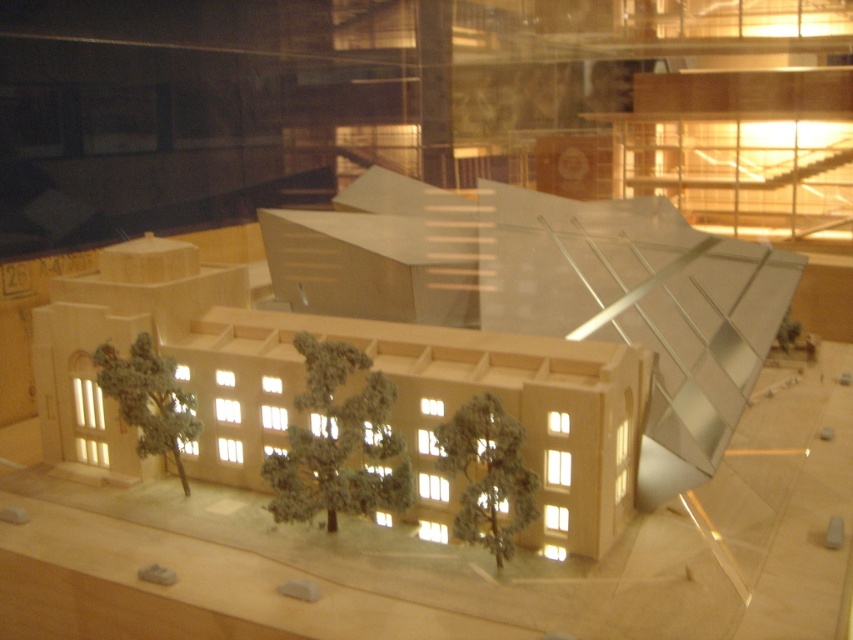
Question: Which object is farther from the camera taking this photo?

Choices:
 (A) green matte tree at lower left
 (B) green matte tree at center

Answer: (A)

Question: Does green matte tree at center have a lesser width compared to green matte tree at lower left?

Choices:
 (A) yes
 (B) no

Answer: (A)

Question: Estimate the real-world distances between objects in this image. Which object is closer to the green matte tree at lower left?

Choices:
 (A) green textured tree at center
 (B) green matte tree at center

Answer: (A)

Question: From the image, what is the correct spatial relationship of green textured tree at center in relation to green matte tree at lower left?

Choices:
 (A) right
 (B) left

Answer: (A)

Question: Which point appears closest to the camera in this image?

Choices:
 (A) (299, 349)
 (B) (167, 452)
 (C) (490, 468)

Answer: (C)

Question: Is green matte tree at center to the left of green matte tree at lower left from the viewer's perspective?

Choices:
 (A) yes
 (B) no

Answer: (B)